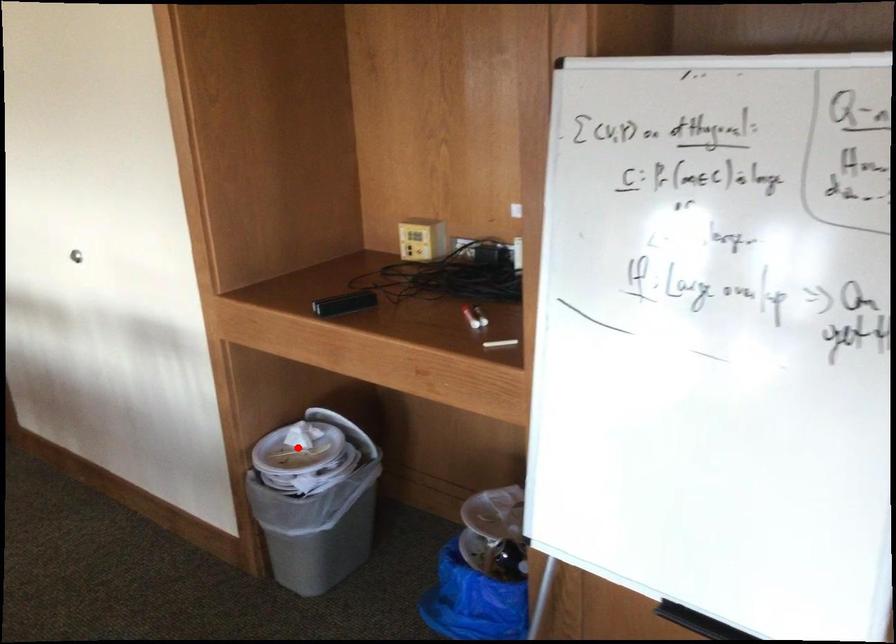
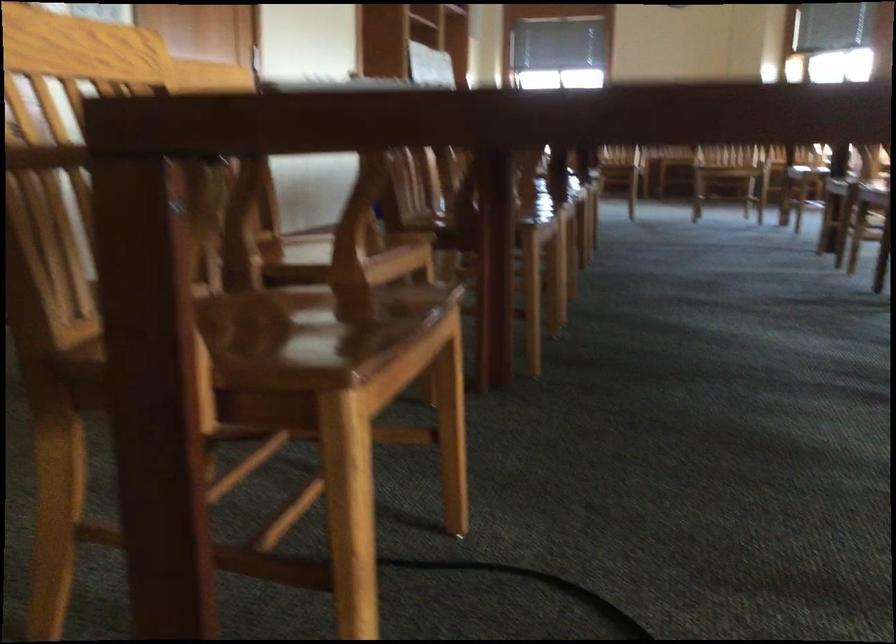
Question: I am providing you with two images of the same scene from different viewpoints. A red point is marked on the first image. Is the red point's position out of view in image 2?

Choices:
 (A) Yes
 (B) No

Answer: (A)